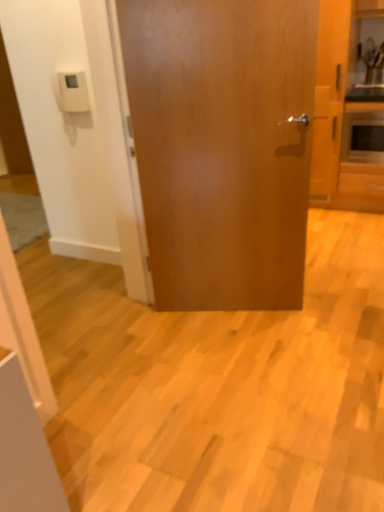
Locate an element on the screen. The height and width of the screenshot is (512, 384). blank space to the left of glossy wood door at center is located at coordinates click(175, 336).